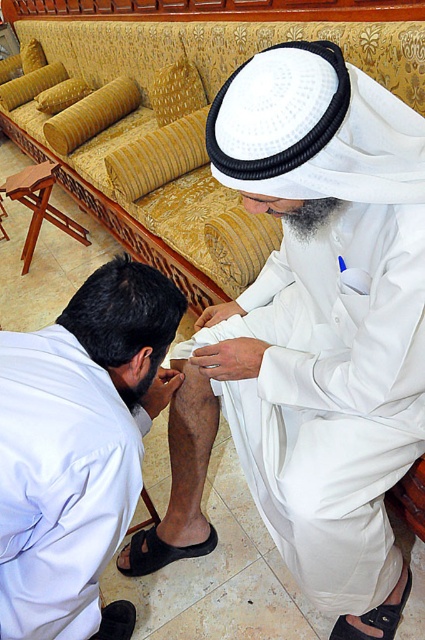
Question: Which point is closer to the camera?

Choices:
 (A) (122, 627)
 (B) (138, 266)
 (C) (360, 634)

Answer: (B)

Question: Is the position of white matte shirt at lower left less distant than that of black suede sandal at lower center?

Choices:
 (A) yes
 (B) no

Answer: (A)

Question: Which point appears closest to the camera in this image?

Choices:
 (A) tap(291, 93)
 (B) tap(153, 561)
 (C) tap(405, 595)

Answer: (A)

Question: In this image, where is white matte shirt at lower left located relative to black suede sandal at lower center?

Choices:
 (A) below
 (B) above

Answer: (B)

Question: Based on their relative distances, which object is nearer to the black leather sandal at lower right?

Choices:
 (A) white matte shirt at lower left
 (B) black leather sandal at lower left
 (C) black suede sandal at lower center
 (D) white matte cloth at center

Answer: (C)

Question: Is white matte cloth at center to the left of black leather sandal at lower right from the viewer's perspective?

Choices:
 (A) yes
 (B) no

Answer: (A)